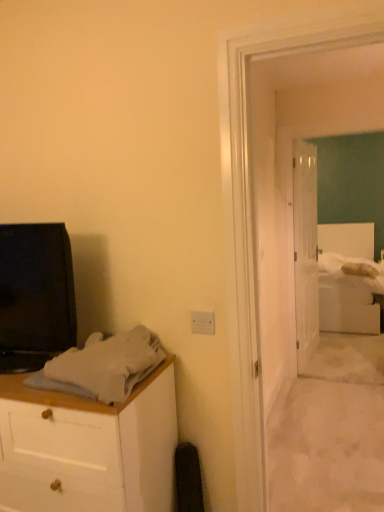
Question: Is the position of white soft bed at right less distant than that of white soft bedsheet at center-right, the second sheet positioned from the left?

Choices:
 (A) no
 (B) yes

Answer: (B)

Question: Is white soft bed at right wider than white soft bedsheet at center-right, the 1th sheet from the top?

Choices:
 (A) no
 (B) yes

Answer: (B)

Question: Is white soft bedsheet at center-right, positioned as the 1th sheet in back-to-front order, a part of white soft bed at right?

Choices:
 (A) yes
 (B) no

Answer: (A)

Question: Does white soft bed at right appear on the right side of white soft bedsheet at center-right, placed as the second sheet when sorted from front to back?

Choices:
 (A) no
 (B) yes

Answer: (B)

Question: From the image's perspective, does white soft bed at right appear higher than white soft bedsheet at center-right, the second sheet from the bottom?

Choices:
 (A) yes
 (B) no

Answer: (B)

Question: Visually, is gray cotton sheet at left, the first sheet in the bottom-to-top sequence, positioned to the left or to the right of white glossy door at center?

Choices:
 (A) right
 (B) left

Answer: (B)

Question: From a real-world perspective, is gray cotton sheet at left, the 1th sheet in the front-to-back sequence, above or below white glossy door at center?

Choices:
 (A) below
 (B) above

Answer: (B)

Question: From their relative heights in the image, would you say gray cotton sheet at left, the first sheet in the bottom-to-top sequence, is taller or shorter than white glossy door at center?

Choices:
 (A) tall
 (B) short

Answer: (B)

Question: Is point (104, 378) positioned closer to the camera than point (309, 240)?

Choices:
 (A) closer
 (B) farther

Answer: (A)

Question: Relative to white soft bedsheet at center-right, the second sheet from the bottom, is white soft bed at right in front or behind?

Choices:
 (A) behind
 (B) front

Answer: (B)

Question: Considering the positions of white soft bed at right and white soft bedsheet at center-right, the first sheet when ordered from right to left, in the image, is white soft bed at right bigger or smaller than white soft bedsheet at center-right, the first sheet when ordered from right to left,?

Choices:
 (A) big
 (B) small

Answer: (A)

Question: In terms of width, does white soft bed at right look wider or thinner when compared to white soft bedsheet at center-right, the second sheet from the bottom?

Choices:
 (A) thin
 (B) wide

Answer: (B)

Question: Visually, is white soft bed at right positioned to the left or to the right of white soft bedsheet at center-right, the second sheet positioned from the left?

Choices:
 (A) left
 (B) right

Answer: (B)

Question: Looking at the image, does white soft bedsheet at center-right, the first sheet when ordered from right to left, seem bigger or smaller compared to white glossy door at center?

Choices:
 (A) small
 (B) big

Answer: (A)

Question: In the image, is white soft bedsheet at center-right, the second sheet from the bottom, positioned in front of or behind white glossy door at center?

Choices:
 (A) front
 (B) behind

Answer: (B)